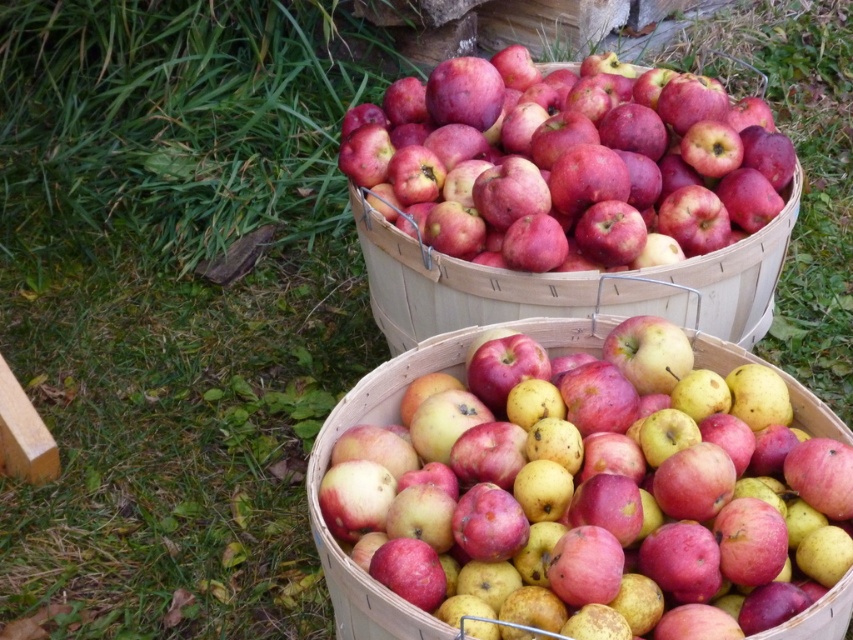
From the picture: You are standing in a field and see two groups of shiny red apples at upper center and shiny red apples at center. Which group of apples is closer to you?

The shiny red apples at upper center are closer to you because they are positioned further to the viewer than the shiny red apples at center.

You are a farmer checking the size of your apples. You have two groups of apples in the image. One is the shiny red apples at upper center and the other is the shiny red apples at center. Which group has apples that are wider?

The shiny red apples at upper center might be wider than the shiny red apples at center according to the description.